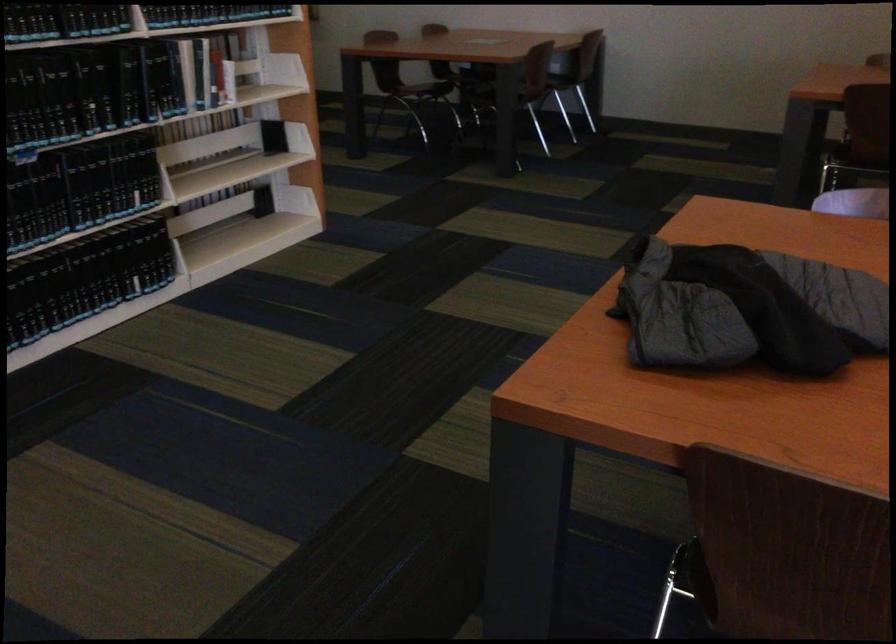
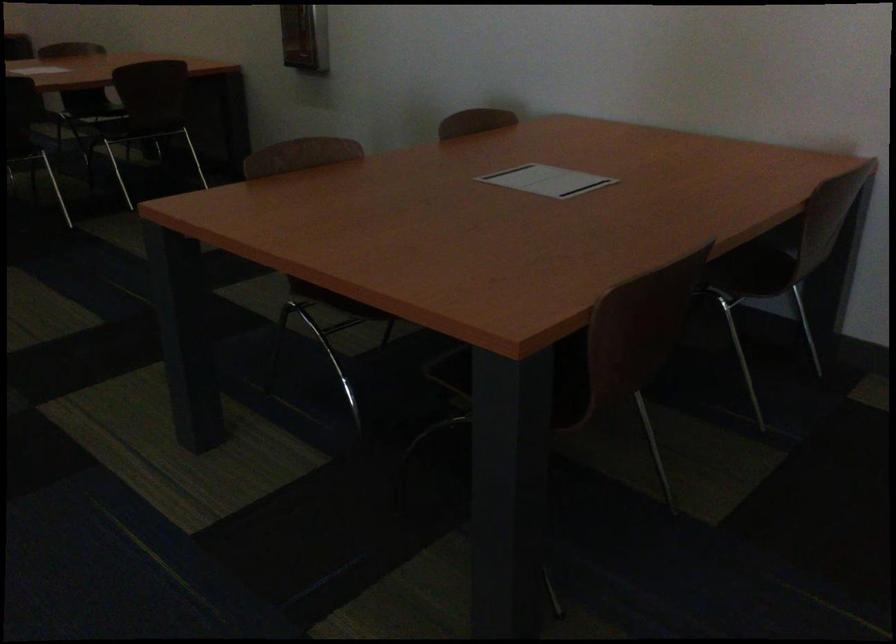
Find the pixel in the second image that matches point 555,70 in the first image.

(764, 272)